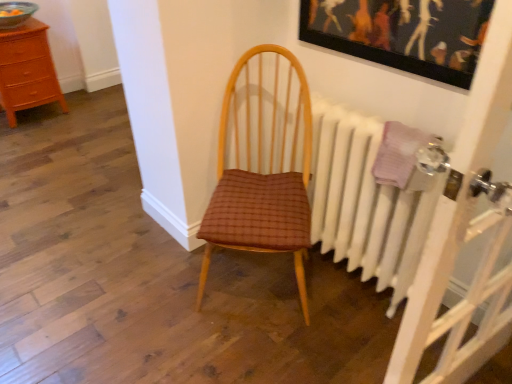
Image resolution: width=512 pixels, height=384 pixels. Identify the location of free region under brown woven fabric chair at center (from a real-world perspective). (256, 281).